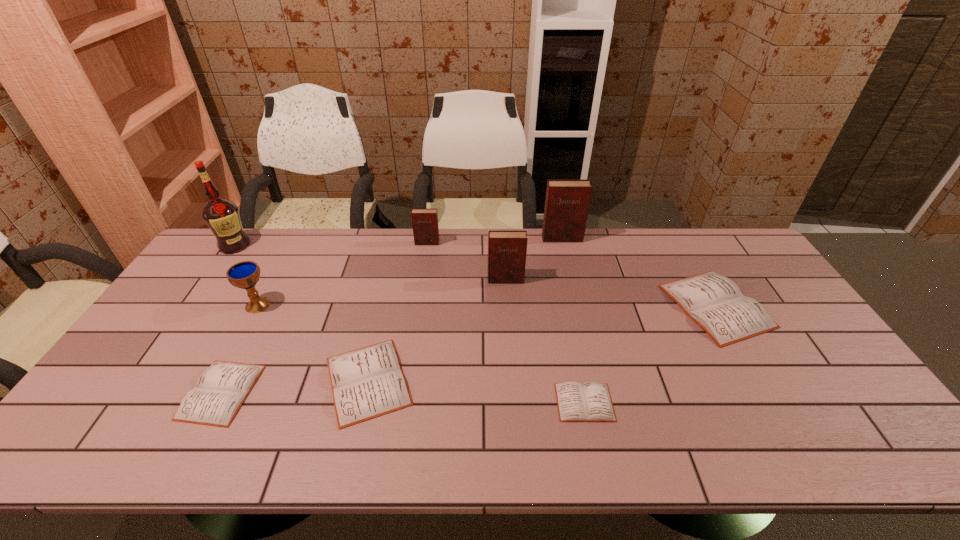
Find the location of a particular element. This screenshot has width=960, height=540. vacant space located on the front of the chalice is located at coordinates (230, 355).

Where is `vacant space positioned 0.240m on the front cover of the third tallest diary`? The width and height of the screenshot is (960, 540). vacant space positioned 0.240m on the front cover of the third tallest diary is located at coordinates (420, 292).

Where is `vacant region located on the left of the rightmost object`? This screenshot has height=540, width=960. vacant region located on the left of the rightmost object is located at coordinates (545, 306).

At what (x,y) coordinates should I click in order to perform the action: click on vacant area located on the left of the second white diary from left to right. Please return your answer as a coordinate pair (x, y). Looking at the image, I should click on (238, 381).

Where is `vacant space situated on the left of the sixth tallest diary`? The height and width of the screenshot is (540, 960). vacant space situated on the left of the sixth tallest diary is located at coordinates click(x=129, y=392).

Find the location of `free space located 0.190m on the back of the second white diary from right to left`. free space located 0.190m on the back of the second white diary from right to left is located at coordinates (569, 328).

Locate an element on the screen. The width and height of the screenshot is (960, 540). alcohol located in the far edge section of the desktop is located at coordinates (222, 216).

Identify the location of object located in the left edge section of the desktop. This screenshot has width=960, height=540. (222, 216).

Where is `object at the right edge`? object at the right edge is located at coordinates (716, 303).

Identify the location of object that is at the far left corner. (222, 216).